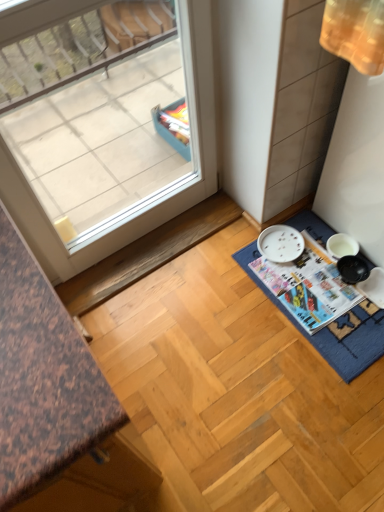
Question: From a real-world perspective, is white glossy magazine at lower right positioned under blue fabric bath mat at lower right based on gravity?

Choices:
 (A) no
 (B) yes

Answer: (A)

Question: From the image's perspective, is white glossy magazine at lower right below blue fabric bath mat at lower right?

Choices:
 (A) yes
 (B) no

Answer: (B)

Question: Is white glossy magazine at lower right located outside blue fabric bath mat at lower right?

Choices:
 (A) yes
 (B) no

Answer: (B)

Question: Can you confirm if white glossy magazine at lower right is positioned to the right of blue fabric bath mat at lower right?

Choices:
 (A) no
 (B) yes

Answer: (A)

Question: Is white glossy magazine at lower right to the left of blue fabric bath mat at lower right from the viewer's perspective?

Choices:
 (A) no
 (B) yes

Answer: (B)

Question: From a real-world perspective, is blue fabric bath mat at lower right physically located above or below white glossy magazine at lower right?

Choices:
 (A) above
 (B) below

Answer: (B)

Question: Would you say blue fabric bath mat at lower right is to the left or to the right of white glossy magazine at lower right in the picture?

Choices:
 (A) left
 (B) right

Answer: (B)

Question: Which is correct: blue fabric bath mat at lower right is inside white glossy magazine at lower right, or outside of it?

Choices:
 (A) outside
 (B) inside

Answer: (A)

Question: Is point (334, 347) closer or farther from the camera than point (254, 262)?

Choices:
 (A) closer
 (B) farther

Answer: (A)

Question: Based on their sizes in the image, would you say transparent glass window at upper left is bigger or smaller than white glossy magazine at lower right?

Choices:
 (A) big
 (B) small

Answer: (A)

Question: Would you say transparent glass window at upper left is to the left or to the right of white glossy magazine at lower right in the picture?

Choices:
 (A) right
 (B) left

Answer: (B)

Question: In the image, is transparent glass window at upper left positioned in front of or behind white glossy magazine at lower right?

Choices:
 (A) front
 (B) behind

Answer: (A)

Question: Is transparent glass window at upper left taller or shorter than white glossy magazine at lower right?

Choices:
 (A) tall
 (B) short

Answer: (A)

Question: Considering the positions of white glossy magazine at lower right and blue fabric bath mat at lower right in the image, is white glossy magazine at lower right bigger or smaller than blue fabric bath mat at lower right?

Choices:
 (A) small
 (B) big

Answer: (A)

Question: Would you say white glossy magazine at lower right is to the left or to the right of blue fabric bath mat at lower right in the picture?

Choices:
 (A) right
 (B) left

Answer: (B)